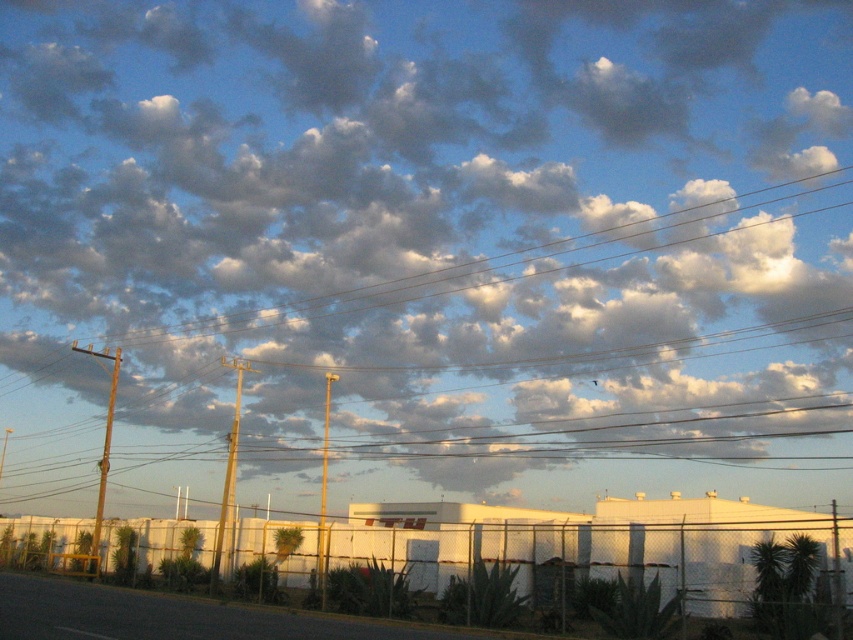
Is smooth wood pole at center positioned at the back of metallic pole at left?

No, it is in front of metallic pole at left.

Does smooth wood pole at center have a smaller size compared to metallic pole at left?

Indeed, smooth wood pole at center has a smaller size compared to metallic pole at left.

Who is more forward, (218, 550) or (106, 432)?

Positioned in front is point (218, 550).

Image resolution: width=853 pixels, height=640 pixels. What are the coordinates of `smooth wood pole at center` in the screenshot? It's located at (228, 481).

Does metallic pole at left have a greater height compared to metallic pole at center?

Yes, metallic pole at left is taller than metallic pole at center.

Between metallic pole at left and metallic pole at center, which one is positioned lower?

metallic pole at center is below.

Which is in front, point (119, 349) or point (318, 534)?

Point (318, 534) is more forward.

Identify the location of metallic pole at left. Image resolution: width=853 pixels, height=640 pixels. (103, 440).

Between smooth wood pole at center and metallic pole at center, which one is positioned lower?

metallic pole at center is lower down.

Does smooth wood pole at center come in front of metallic pole at center?

No, it is behind metallic pole at center.

The image size is (853, 640). Describe the element at coordinates (228, 481) in the screenshot. I see `smooth wood pole at center` at that location.

Find the location of `smooth wood pole at center`. smooth wood pole at center is located at coordinates (228, 481).